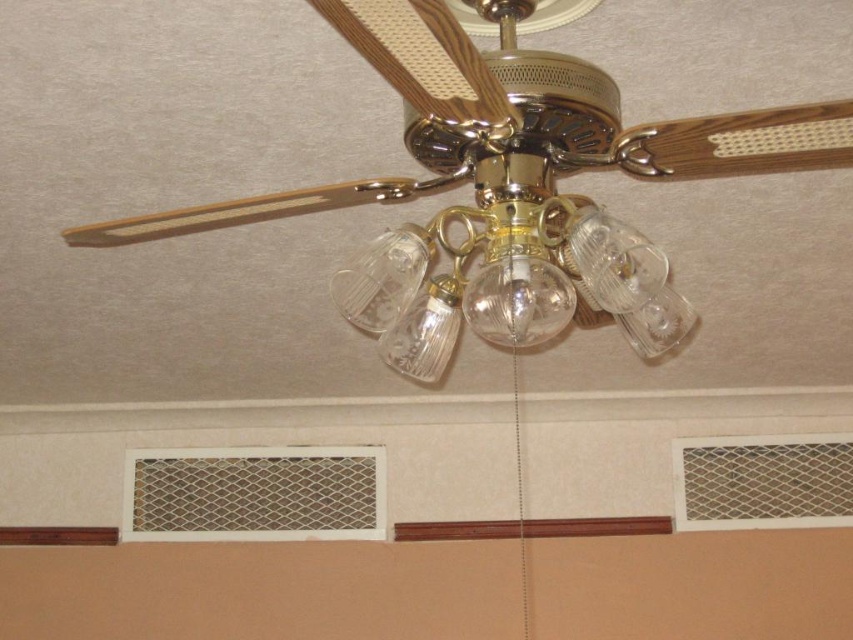
What do you see at coordinates (434, 68) in the screenshot? I see `gold/wooden ceiling fan at center` at bounding box center [434, 68].

Between gold/wooden ceiling fan at center and clear glass light fixture at center, which one is positioned higher?

Positioned higher is gold/wooden ceiling fan at center.

What are the coordinates of `gold/wooden ceiling fan at center` in the screenshot? It's located at (434, 68).

Identify the location of gold/wooden ceiling fan at center. (434, 68).